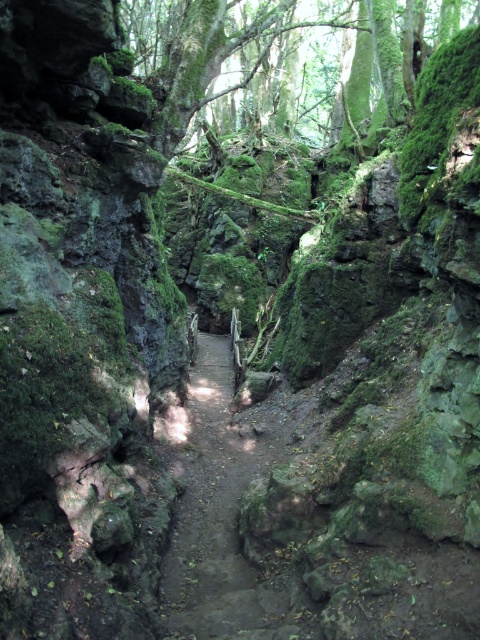
Question: Is dirt path at center above green mossy tree at upper center?

Choices:
 (A) yes
 (B) no

Answer: (B)

Question: Which of the following is the closest to the observer?

Choices:
 (A) (304, 120)
 (B) (289, 602)

Answer: (B)

Question: Among these objects, which one is nearest to the camera?

Choices:
 (A) dirt path at center
 (B) green mossy tree at upper center

Answer: (A)

Question: Which point appears closest to the camera in this image?

Choices:
 (A) (327, 45)
 (B) (254, 454)

Answer: (B)

Question: Does dirt path at center lie in front of green mossy tree at upper center?

Choices:
 (A) no
 (B) yes

Answer: (B)

Question: Can you confirm if dirt path at center is positioned to the left of green mossy tree at upper center?

Choices:
 (A) yes
 (B) no

Answer: (A)